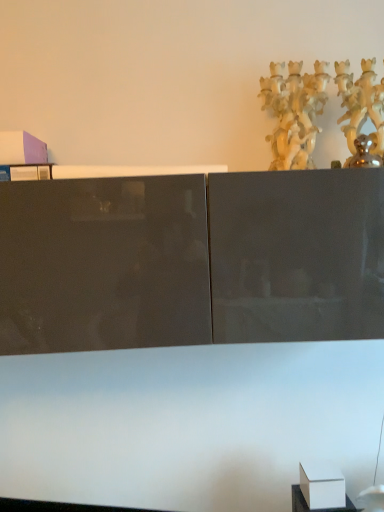
Measure the distance between point [294,484] and camera.

The distance of point [294,484] from camera is 4.62 feet.

What do you see at coordinates (316, 509) in the screenshot?
I see `white glossy cube at lower right` at bounding box center [316, 509].

I want to click on white glossy cube at lower right, so click(316, 509).

At what (x,y) coordinates should I click in order to perform the action: click on white glossy cube at lower right. Please return your answer as a coordinate pair (x, y). This screenshot has height=512, width=384. Looking at the image, I should click on (316, 509).